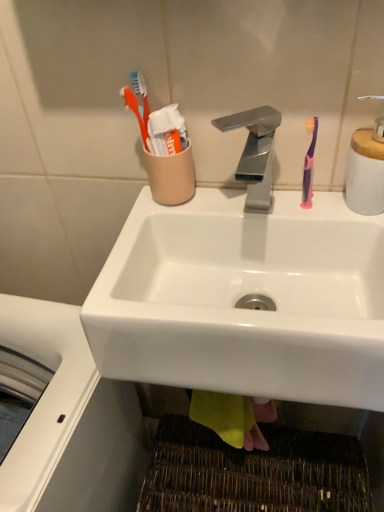
Question: Is pink plastic toothbrush at right bigger or smaller than white ceramic soap dispenser at upper right?

Choices:
 (A) big
 (B) small

Answer: (B)

Question: Is pink plastic toothbrush at right spatially inside white ceramic soap dispenser at upper right, or outside of it?

Choices:
 (A) inside
 (B) outside

Answer: (B)

Question: Based on their relative distances, which object is nearer to the white glossy sink at center?

Choices:
 (A) white ceramic soap dispenser at upper right
 (B) polished metallic faucet at center
 (C) pink plastic toothbrush at right

Answer: (B)

Question: Which of these objects is positioned farthest from the polished metallic faucet at center?

Choices:
 (A) white ceramic soap dispenser at upper right
 (B) pink plastic toothbrush at right
 (C) white glossy sink at center

Answer: (C)